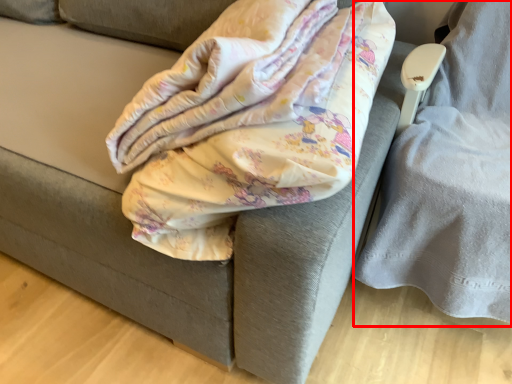
Question: From the image's perspective, what is the correct spatial positioning of swivel chair (annotated by the red box) in reference to blanket?

Choices:
 (A) below
 (B) above

Answer: (A)